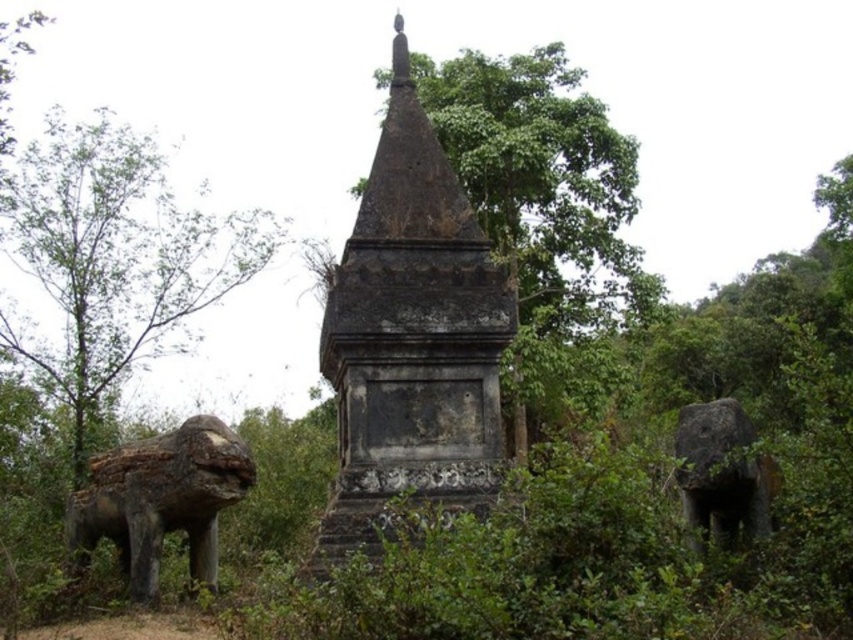
Is point (468, 392) closer to camera compared to point (155, 204)?

Yes, point (468, 392) is closer to viewer.

Find the location of a particular element. This screenshot has width=853, height=640. dark gray stone stupa at center is located at coordinates (410, 337).

From the picture: Is dark gray stone stupa at center below green leafy tree at center?

Correct, dark gray stone stupa at center is located below green leafy tree at center.

The width and height of the screenshot is (853, 640). Describe the element at coordinates (410, 337) in the screenshot. I see `dark gray stone stupa at center` at that location.

Measure the distance between dark gray stone stupa at center and camera.

24.61 meters

Locate an element on the screen. Image resolution: width=853 pixels, height=640 pixels. dark gray stone stupa at center is located at coordinates (410, 337).

In the scene shown: Who is taller, green leafy tree at left or green leafy tree at center?

→ With more height is green leafy tree at center.

Between green leafy tree at left and green leafy tree at center, which one is positioned higher?

green leafy tree at center is above.

The image size is (853, 640). What are the coordinates of `green leafy tree at left` in the screenshot? It's located at (113, 259).